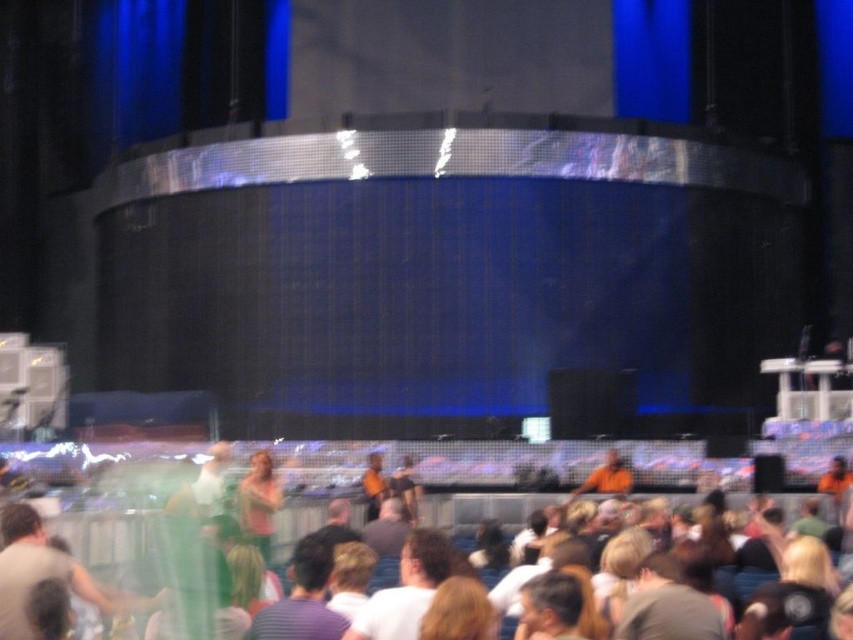
You are standing at the point labeled point (375, 481) and want to move to the stage area. Is the point labeled point (709, 624) blocking your path?

Point (709, 624) is in front of point (375, 481), so it would block your path to the stage area.